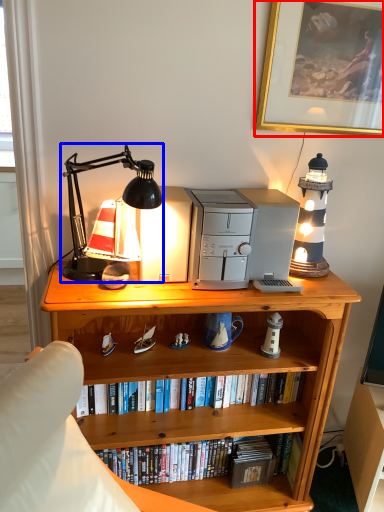
Question: Which point is closer to the camera, picture frame (highlighted by a red box) or lamp (highlighted by a blue box)?

Choices:
 (A) picture frame
 (B) lamp

Answer: (B)